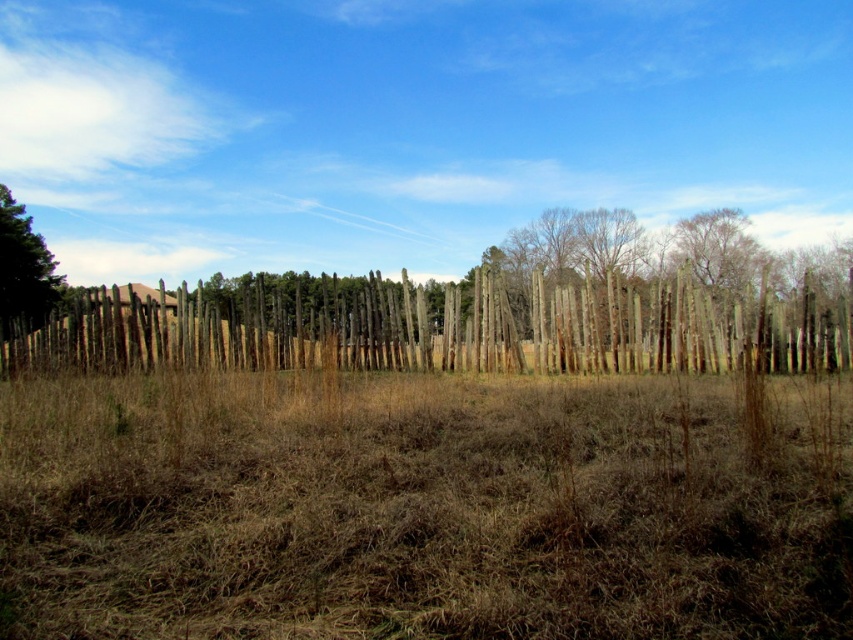
The height and width of the screenshot is (640, 853). Describe the element at coordinates (424, 508) in the screenshot. I see `brown dry grass at center` at that location.

Which is below, brown dry grass at center or green textured tree at left?

brown dry grass at center

Image resolution: width=853 pixels, height=640 pixels. Find the location of `brown dry grass at center`. brown dry grass at center is located at coordinates point(424,508).

The image size is (853, 640). Describe the element at coordinates (424, 508) in the screenshot. I see `brown dry grass at center` at that location.

Does brown dry grass at center have a greater width compared to wooden fence at center?

Incorrect, brown dry grass at center's width does not surpass wooden fence at center's.

Is point (460, 554) less distant than point (815, 362)?

Yes, point (460, 554) is closer to viewer.

The height and width of the screenshot is (640, 853). I want to click on brown dry grass at center, so click(x=424, y=508).

Consider the image. Which of these two, wooden fence at center or green textured tree at left, stands taller?

With more height is green textured tree at left.

Does wooden fence at center appear over green textured tree at left?

No.

Between point (47, 339) and point (7, 323), which one is positioned in front?

Point (47, 339) is more forward.

At what (x,y) coordinates should I click in order to perform the action: click on wooden fence at center. Please return your answer as a coordinate pair (x, y). The height and width of the screenshot is (640, 853). Looking at the image, I should click on (277, 326).